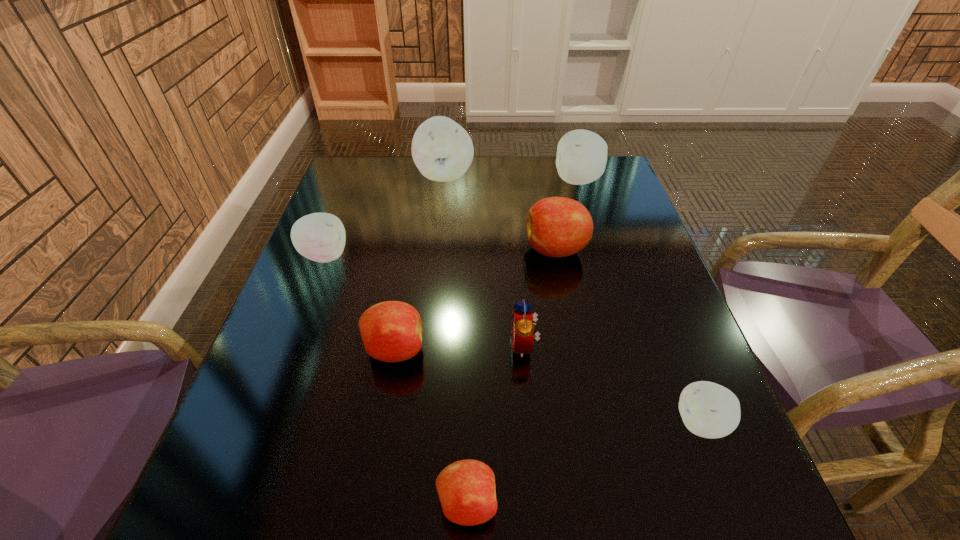
The width and height of the screenshot is (960, 540). What are the coordinates of `vacant space at the right edge of the desktop` in the screenshot? It's located at (655, 300).

In the image, there is a desktop. Where is `free space at the far left corner`? The width and height of the screenshot is (960, 540). free space at the far left corner is located at coordinates (384, 190).

The width and height of the screenshot is (960, 540). Identify the location of free space at the far right corner of the desktop. (619, 190).

At what (x,y) coordinates should I click in order to perform the action: click on free point between the second biggest white apple and the sixth farthest apple. Please return your answer as a coordinate pair (x, y). The height and width of the screenshot is (540, 960). Looking at the image, I should click on (639, 302).

Find the location of a particular element. The image size is (960, 540). blank region between the second smallest white apple and the tallest apple is located at coordinates (385, 215).

The image size is (960, 540). What are the coordinates of `vacant point located between the third smallest white apple and the tallest apple` in the screenshot? It's located at (512, 178).

This screenshot has width=960, height=540. I want to click on free space between the nearest object and the farthest red apple, so click(x=512, y=376).

I want to click on vacant region between the alarm clock and the second nearest red apple, so click(459, 347).

Where is `empty space that is in between the third smallest white apple and the leftmost red apple`? empty space that is in between the third smallest white apple and the leftmost red apple is located at coordinates (486, 265).

You are a GUI agent. You are given a task and a screenshot of the screen. Output one action in this format:
    pyautogui.click(x=<x>, y=<y>)
    Task: Click on the vacant space that's between the leftmost object and the red alarm clock
    The width and height of the screenshot is (960, 540).
    Given the screenshot: What is the action you would take?
    pyautogui.click(x=424, y=300)